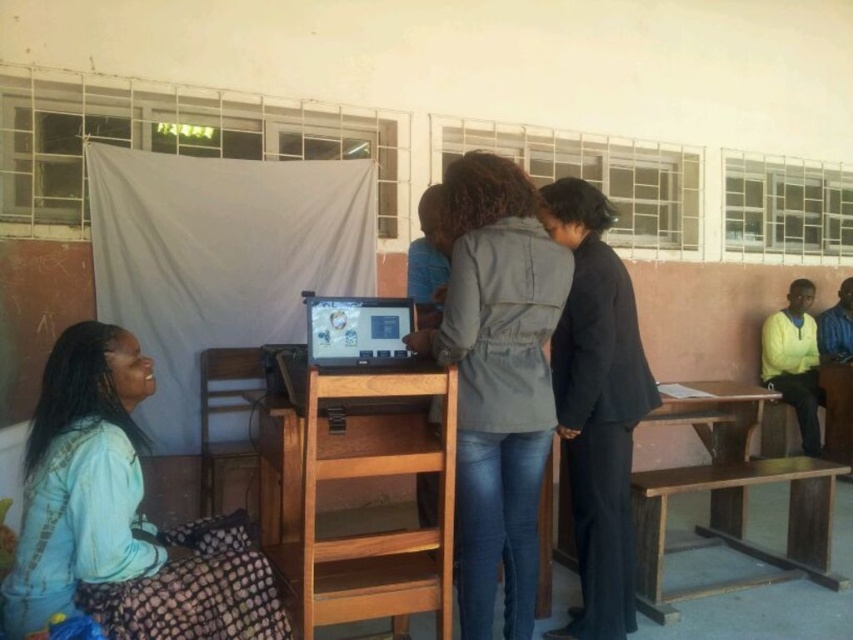
Is light blue fabric skirt at lower left bigger than black matte suit at center?

No.

Is point (137, 426) positioned behind point (637, 388)?

Yes, point (137, 426) is behind point (637, 388).

Is point (22, 627) positioned in front of point (624, 532)?

Yes, point (22, 627) is in front of point (624, 532).

Find the location of `light blue fabric skirt at lower left`. light blue fabric skirt at lower left is located at coordinates (83, 480).

Is point (35, 602) closer to camera compared to point (373, 342)?

Yes, point (35, 602) is in front of point (373, 342).

Between light blue fabric skirt at lower left and matte black computer at center, which one is positioned lower?

light blue fabric skirt at lower left is lower down.

Is point (65, 545) positioned in front of point (403, 346)?

Yes, it is.

Where is `light blue fabric skirt at lower left`? The width and height of the screenshot is (853, 640). light blue fabric skirt at lower left is located at coordinates (83, 480).

Does denim jacket at center come behind matte black computer at center?

No, denim jacket at center is closer to the viewer.

Between point (474, 154) and point (364, 337), which one is positioned in front?

Point (474, 154) is more forward.

Is point (523, 452) positioned before point (329, 316)?

Yes, point (523, 452) is in front of point (329, 316).

Where is `denim jacket at center`? denim jacket at center is located at coordinates (496, 378).